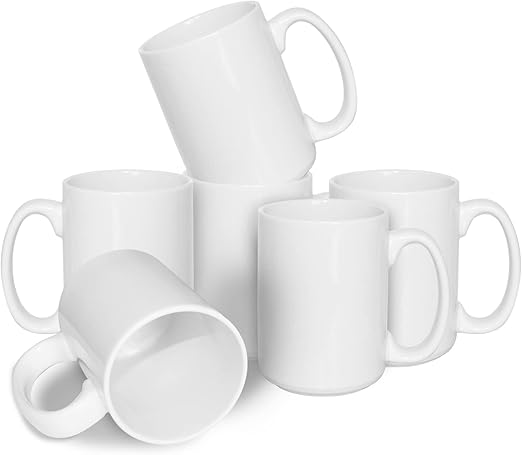
Identify the location of white mugs. (121, 222), (129, 315), (308, 301), (251, 128), (227, 240), (423, 220).